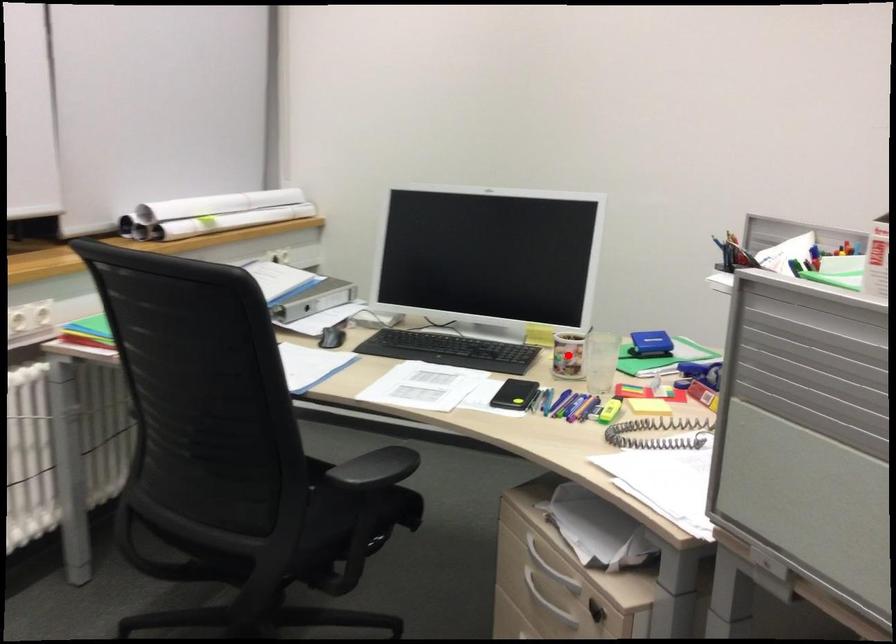
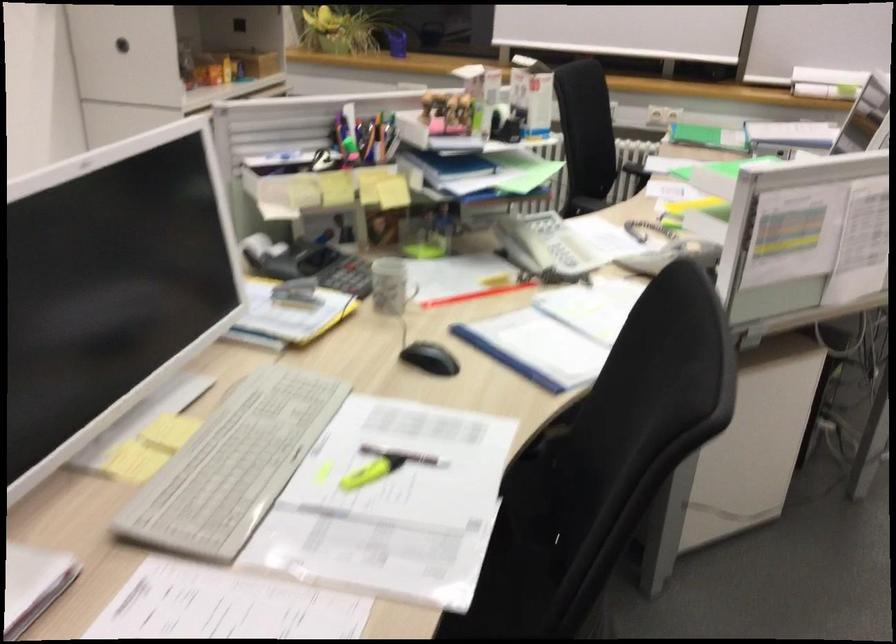
Question: I am providing you with two images of the same scene from different viewpoints. A red point is marked on the first image. Is the red point's position out of view in image 2?

Choices:
 (A) Yes
 (B) No

Answer: (A)